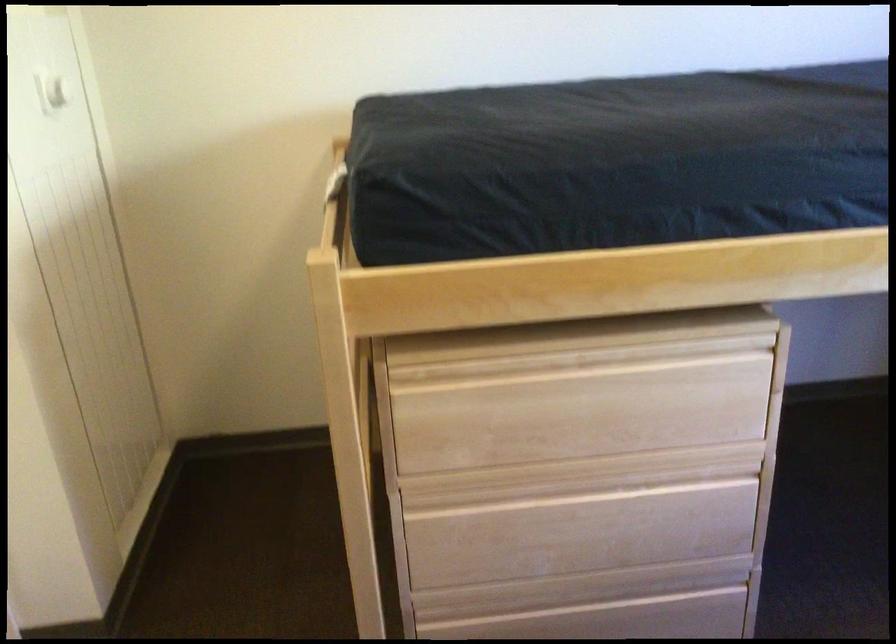
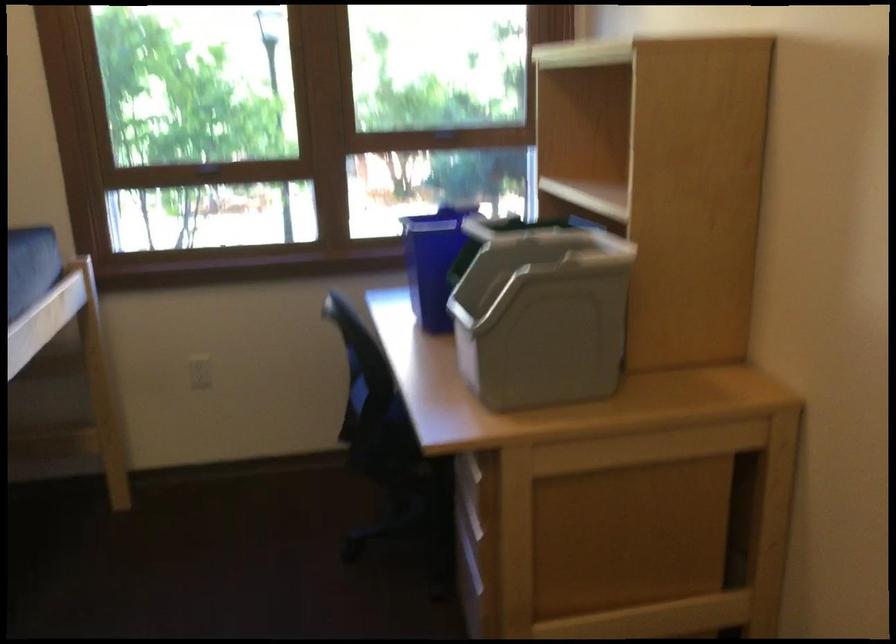
Question: How did the camera likely rotate?

Choices:
 (A) Left
 (B) Right
 (C) Up
 (D) Down

Answer: (B)